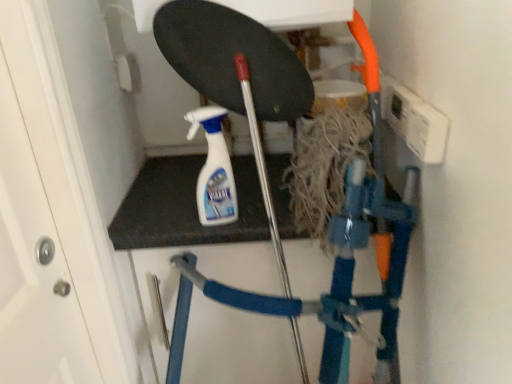
Locate an element on the screen. This screenshot has width=512, height=384. vacant space behind white plastic spray bottle at center is located at coordinates (194, 178).